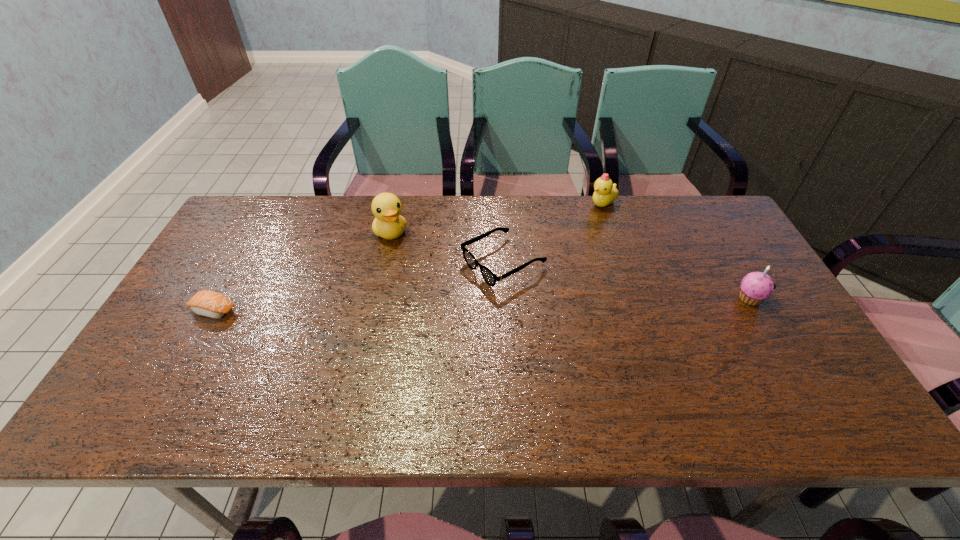
This screenshot has width=960, height=540. Identify the location of object that is the closest one to the shortest object. (389, 224).

You are a GUI agent. You are given a task and a screenshot of the screen. Output one action in this format:
    pyautogui.click(x=<x>, y=<y>)
    Task: Click on the free point that satisfies the following two spatial constraints: 1. on the front side of the rightmost object; 2. on the face of the second shortest object
    The width and height of the screenshot is (960, 540).
    Given the screenshot: What is the action you would take?
    pyautogui.click(x=505, y=299)

Locate an element on the screen. This screenshot has height=540, width=960. free location that satisfies the following two spatial constraints: 1. on the back side of the third object from left to right; 2. on the left side of the leftmost object is located at coordinates (240, 262).

Locate an element on the screen. The height and width of the screenshot is (540, 960). vacant space that satisfies the following two spatial constraints: 1. on the back side of the duck; 2. on the right side of the farthest object is located at coordinates (397, 204).

What are the coordinates of `free space that satisfies the following two spatial constraints: 1. on the back side of the fourth object from left to right; 2. on the right side of the leftmost object` in the screenshot? It's located at (274, 204).

The image size is (960, 540). What are the coordinates of `free location that satisfies the following two spatial constraints: 1. on the back side of the sushi; 2. on the right side of the tallest object` in the screenshot? It's located at (257, 232).